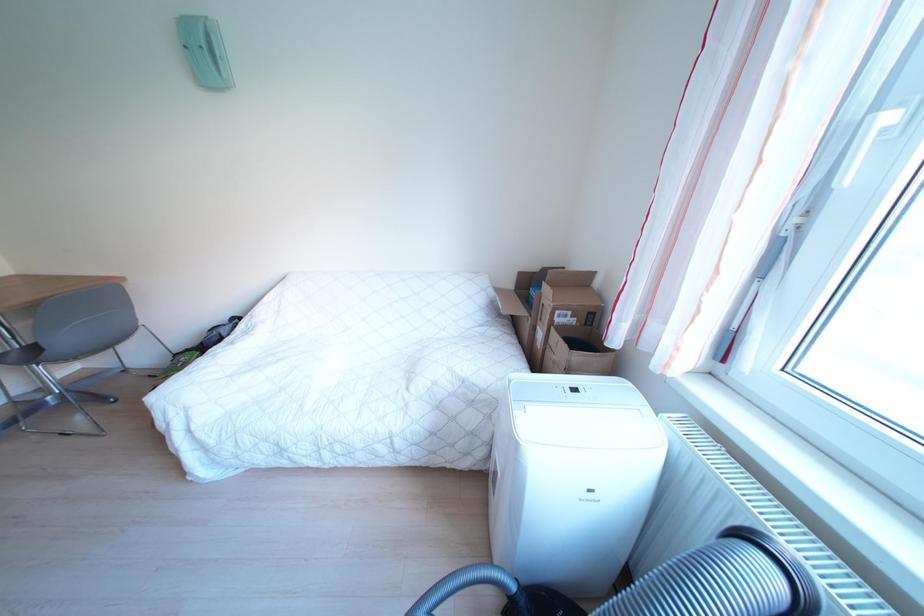
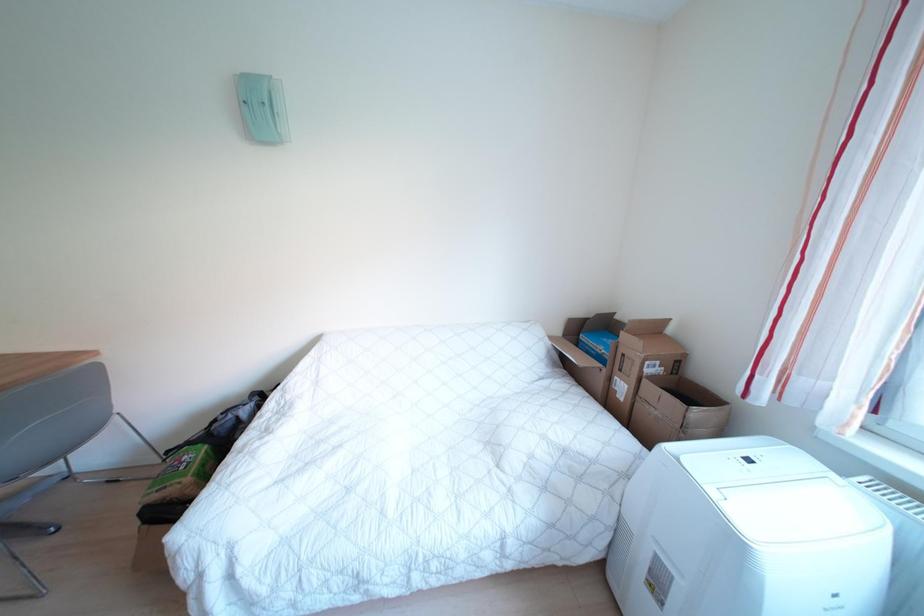
Question: The first image is from the beginning of the video and the second image is from the end. How did the camera likely rotate when shooting the video?

Choices:
 (A) Left
 (B) Right
 (C) Up
 (D) Down

Answer: (C)